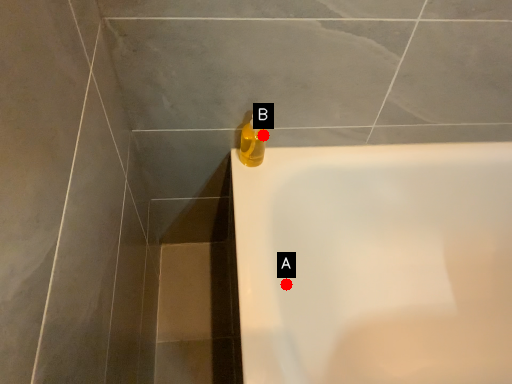
Question: Two points are circled on the image, labeled by A and B beside each circle. Which point is closer to the camera taking this photo?

Choices:
 (A) A is closer
 (B) B is closer

Answer: (A)